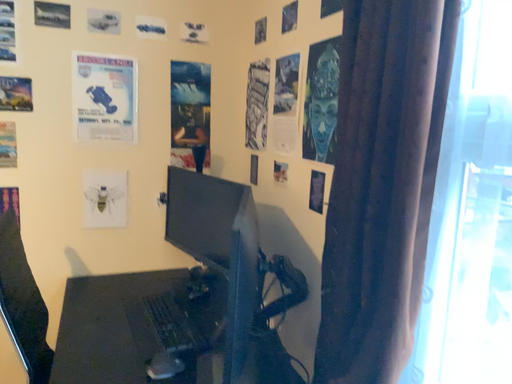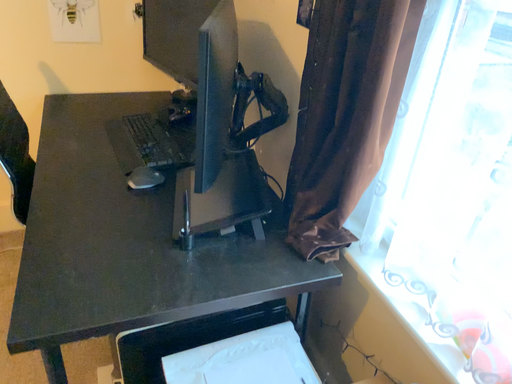
Question: Which way did the camera rotate in the video?

Choices:
 (A) rotated downward
 (B) rotated upward

Answer: (A)